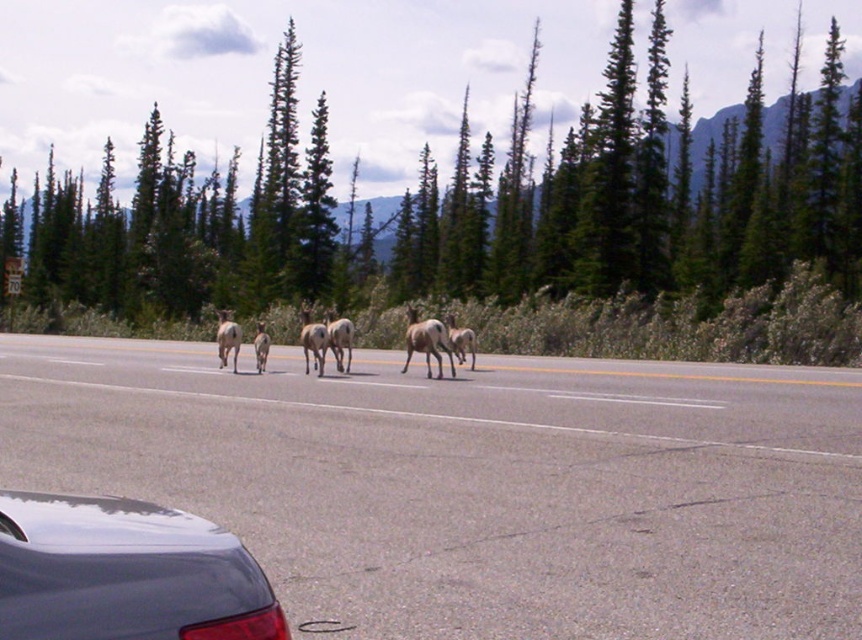
Based on the photo, which is below, gray asphalt highway at center or glossy dark blue car at lower left?

gray asphalt highway at center is below.

Describe the element at coordinates (475, 484) in the screenshot. I see `gray asphalt highway at center` at that location.

Locate an element on the screen. gray asphalt highway at center is located at coordinates (475, 484).

Where is `gray asphalt highway at center`? gray asphalt highway at center is located at coordinates (475, 484).